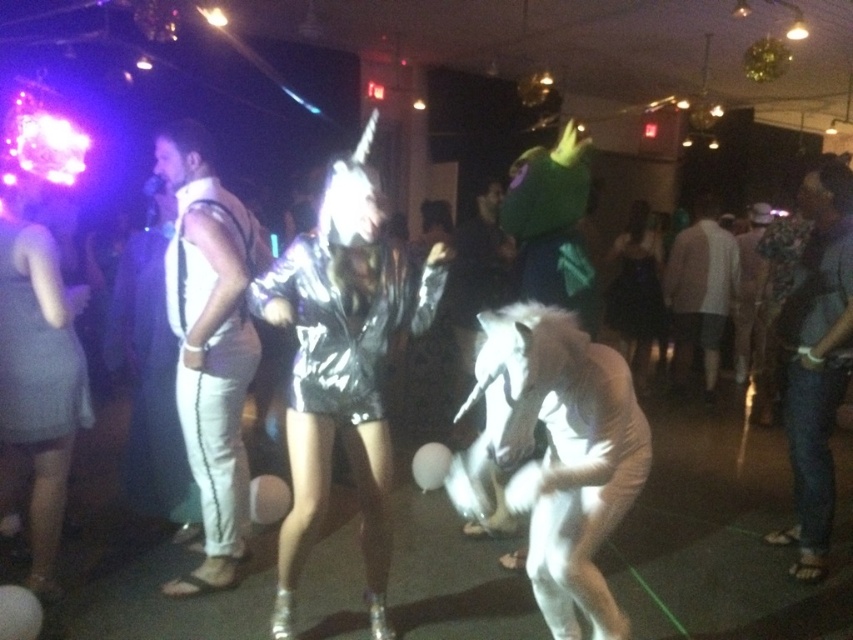
You are at a party and want to take a photo of both the shiny silver outfit with a high collar and the white horse costume. The camera you have can only focus on objects at a certain distance. Given that the shiny silver outfit with a high collar corresponds to point (171, 184) and the white horse costume corresponds to point (817, 525), which costume is closer to you so you can focus properly?

The shiny silver outfit with a high collar is closer to you because point (171, 184) is closer to the viewer than point (817, 525), which corresponds to the white horse costume.

You are at a party and want to take a photo with both the denim jeans at right and the white furry costume at center. Since you can only focus on one object at a time, which one should you focus on to ensure the other is still in the background?

You should focus on the denim jeans at right because it is closer to the viewer, allowing the white furry costume at center to remain in the background and still be visible in the photo.